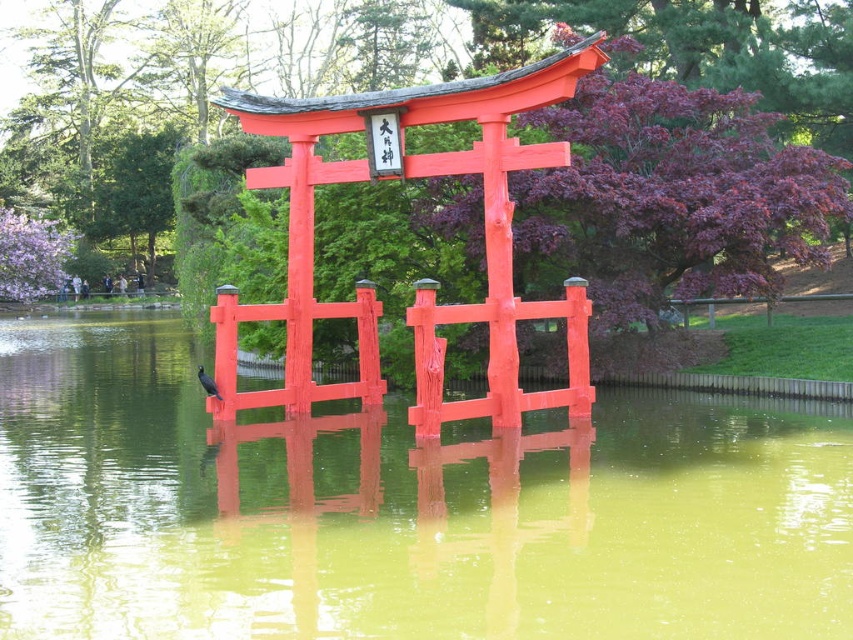
You are a photographer planning to capture the reflection of the smooth glossy red shrine at center and the shiny black bird at center in the pond. Based on their heights, which object will have a larger reflection in the water?

The smooth glossy red shrine at center is much taller than the shiny black bird at center, so its reflection will be larger in the water.

Looking at this image, you are standing on a wooden deck near the pond and want to toss a small pebble into the greenish water at center. Based on the distance provided, can you estimate whether you need to throw it with moderate force or just a light toss?

The greenish water at center is 7.98 meters away from the viewer. Since 7.98 meters is a considerable distance, you would need to throw the pebble with moderate force to reach it.

You are a photographer planning to capture the reflection of the torii gate in the greenish water at center. A shiny black bird at center is currently flying towards the water. If the bird lands on the water, will it disrupt the reflection of the torii gate? Please explain based on their distance.

The greenish water at center and shiny black bird at center are 20.64 feet apart. Since the bird is 20.64 feet away from the water, landing there would not disrupt the reflection of the torii gate because the distance is too far to cause significant ripples.